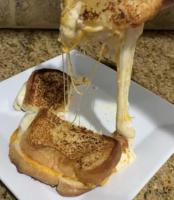
Identify the location of plate. (89, 113).